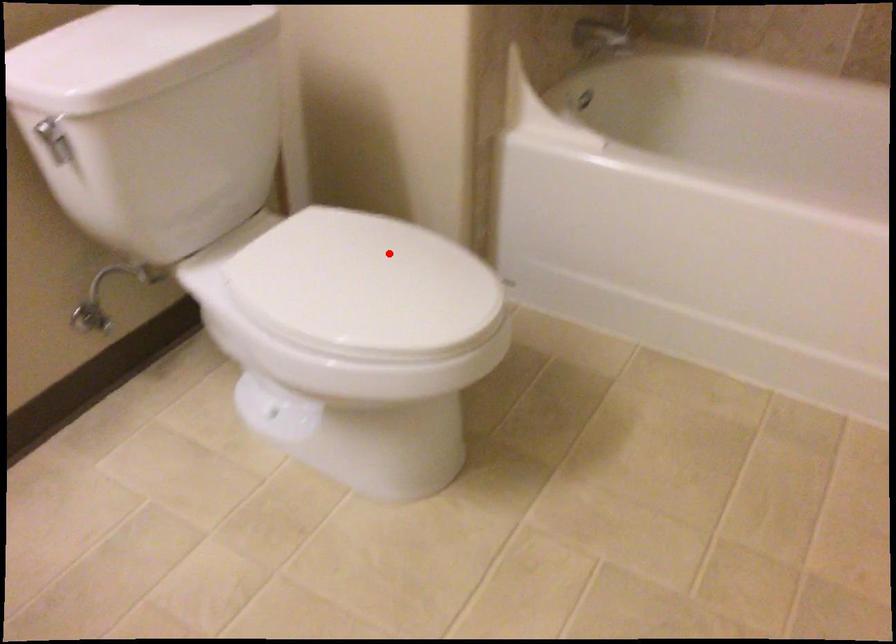
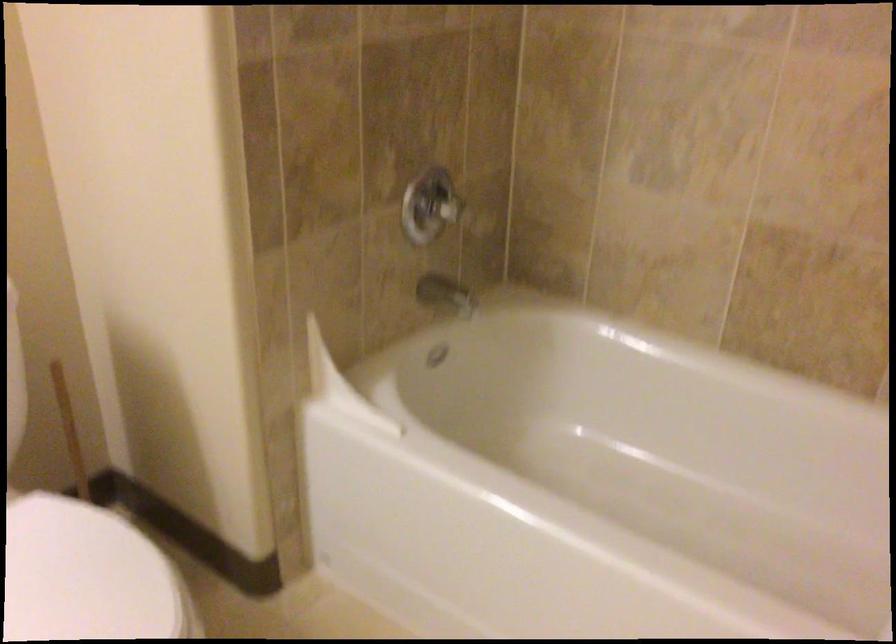
In the second image, find the point that corresponds to the highlighted location in the first image.

(88, 576)